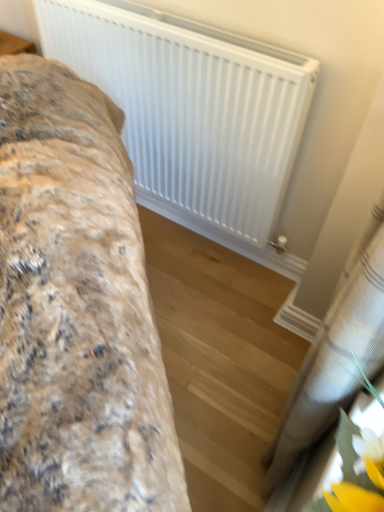
Question: Does fluffy fabric bed at left come in front of white matte radiator at upper center?

Choices:
 (A) yes
 (B) no

Answer: (A)

Question: Is fluffy fabric bed at left further to camera compared to white matte radiator at upper center?

Choices:
 (A) no
 (B) yes

Answer: (A)

Question: Considering the relative sizes of fluffy fabric bed at left and white matte radiator at upper center in the image provided, is fluffy fabric bed at left thinner than white matte radiator at upper center?

Choices:
 (A) yes
 (B) no

Answer: (B)

Question: Does fluffy fabric bed at left turn towards white matte radiator at upper center?

Choices:
 (A) no
 (B) yes

Answer: (A)

Question: From the image's perspective, is fluffy fabric bed at left under white matte radiator at upper center?

Choices:
 (A) no
 (B) yes

Answer: (B)

Question: Does point (86, 173) appear closer or farther from the camera than point (66, 11)?

Choices:
 (A) closer
 (B) farther

Answer: (A)

Question: Is fluffy fabric bed at left wider or thinner than white matte radiator at upper center?

Choices:
 (A) wide
 (B) thin

Answer: (A)

Question: Considering their positions, is fluffy fabric bed at left located in front of or behind white matte radiator at upper center?

Choices:
 (A) front
 (B) behind

Answer: (A)

Question: In terms of size, does fluffy fabric bed at left appear bigger or smaller than white matte radiator at upper center?

Choices:
 (A) big
 (B) small

Answer: (A)

Question: Considering their positions, is white matte radiator at upper center located in front of or behind fluffy fabric bed at left?

Choices:
 (A) behind
 (B) front

Answer: (A)

Question: Considering the positions of white matte radiator at upper center and fluffy fabric bed at left in the image, is white matte radiator at upper center taller or shorter than fluffy fabric bed at left?

Choices:
 (A) tall
 (B) short

Answer: (B)

Question: Based on their sizes in the image, would you say white matte radiator at upper center is bigger or smaller than fluffy fabric bed at left?

Choices:
 (A) big
 (B) small

Answer: (B)

Question: Is point (173, 111) closer or farther from the camera than point (127, 157)?

Choices:
 (A) closer
 (B) farther

Answer: (A)

Question: Considering the positions of white sheer curtain at lower right and fluffy fabric bed at left in the image, is white sheer curtain at lower right taller or shorter than fluffy fabric bed at left?

Choices:
 (A) short
 (B) tall

Answer: (A)

Question: Is white sheer curtain at lower right in front of or behind fluffy fabric bed at left in the image?

Choices:
 (A) front
 (B) behind

Answer: (A)